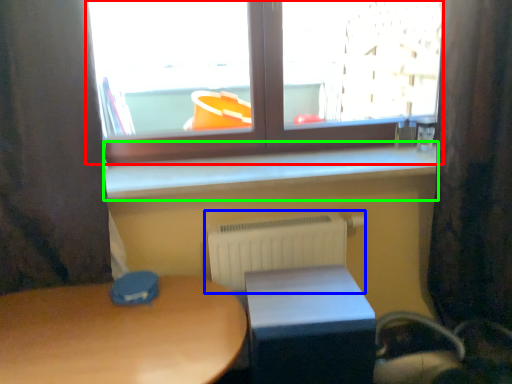
Question: Estimate the real-world distances between objects in this image. Which object is farther from window (highlighted by a red box), radiator (highlighted by a blue box) or window sill (highlighted by a green box)?

Choices:
 (A) radiator
 (B) window sill

Answer: (A)